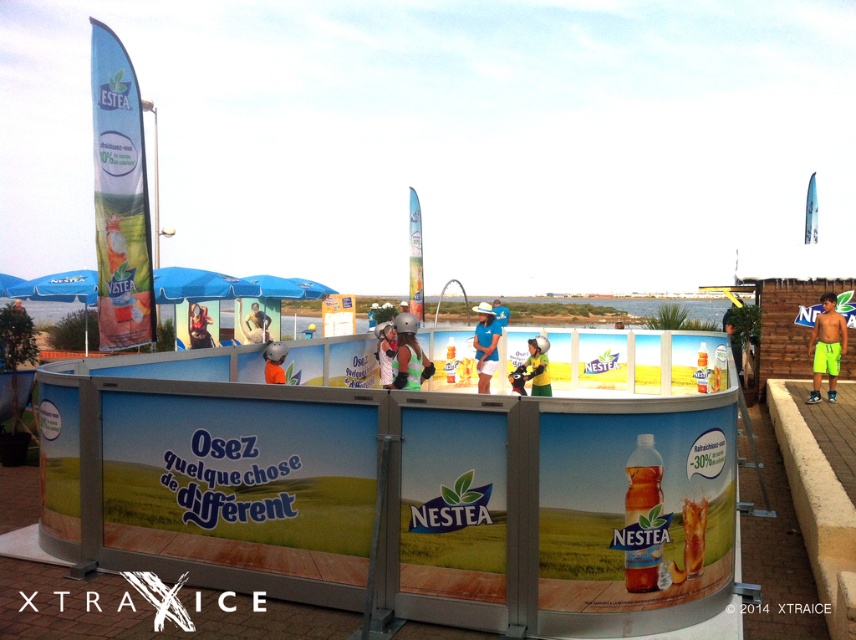
You are a photographer standing at the edge of the Nestea promotional platform. You want to capture a photo of the neon green shorts at right and the yellow fabric at center in the same frame. Given that your camera has a maximum focus range of 4 meters, will you be able to include both objects in focus without moving your position?

The distance between the neon green shorts at right and the yellow fabric at center is 4.31 meters. Since your camera can only focus within 4 meters, the objects are slightly out of the maximum focus range. Therefore, you won

You are a photographer at the Nestea event and need to capture a clear shot of both the matte white helmet at center and the orange fabric helmet at center. Since you want to ensure both are visible, which helmet should you focus on first to account for their sizes?

The matte white helmet at center is taller than the orange fabric helmet at center, so you should focus on the matte white helmet at center first to ensure it doesn t get obscured by other elements in the frame.

You are a photographer trying to capture a clear shot of the orange fabric helmet at center without the yellow fabric at center overlapping it. Based on the scene description, is this possible? Explain why or why not.

The yellow fabric at center is bigger than the orange fabric helmet at center. Since the yellow fabric is larger, it may block the view of the orange fabric helmet at center unless positioned carefully. However, since both are at the center, overlapping is likely unless there is a strategic angle or elevation change to avoid it.